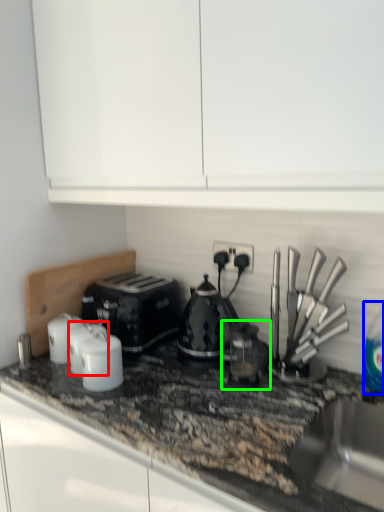
Question: Which object is positioned farthest from kitchen appliance (highlighted by a red box)? Select from bottle (highlighted by a blue box) and coffee machine (highlighted by a green box).

Choices:
 (A) bottle
 (B) coffee machine

Answer: (A)